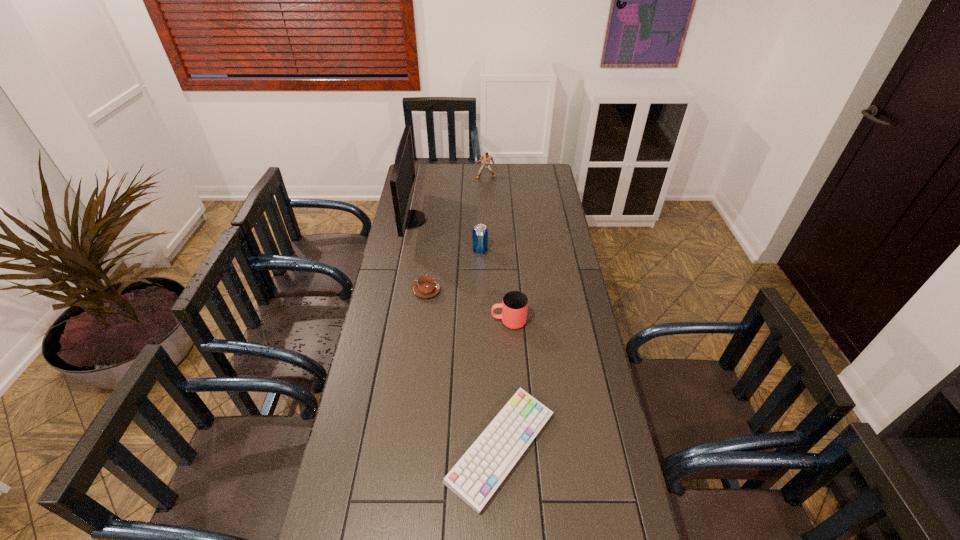
Where is `computer monitor`? computer monitor is located at coordinates pyautogui.click(x=402, y=179).

I want to click on the farthest object, so click(487, 158).

Identify the location of beer can. The width and height of the screenshot is (960, 540). (480, 233).

Identify the location of cup. (514, 306).

Find the location of a particular element. The image size is (960, 540). the fourth farthest object is located at coordinates (426, 287).

This screenshot has height=540, width=960. Identify the location of the nearest object. (477, 475).

In order to click on free space located 0.380m on the front-facing side of the computer monitor in this screenshot , I will do `click(508, 220)`.

You are a GUI agent. You are given a task and a screenshot of the screen. Output one action in this format:
    pyautogui.click(x=<x>, y=<y>)
    Task: Click on the free spot located 0.180m on the front-facing side of the farthest object
    The image size is (960, 540).
    Given the screenshot: What is the action you would take?
    pyautogui.click(x=486, y=198)

This screenshot has width=960, height=540. In order to click on free point located 0.050m on the front of the beer can in this screenshot , I will do `click(480, 264)`.

At what (x,y) coordinates should I click in order to perform the action: click on vacant area situated on the handle side of the fifth farthest object. Please return your answer as a coordinate pair (x, y). Looking at the image, I should click on (389, 321).